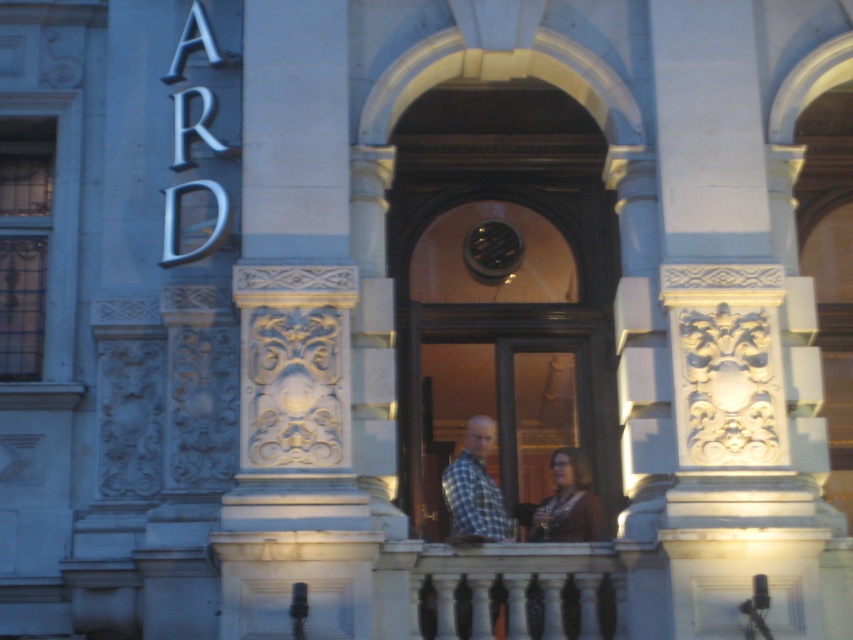
Can you confirm if white stone carving at center is positioned to the left of brown fabric at center?

Correct, you'll find white stone carving at center to the left of brown fabric at center.

Is white stone carving at center smaller than brown fabric at center?

No.

What do you see at coordinates (294, 339) in the screenshot?
I see `white stone carving at center` at bounding box center [294, 339].

Locate an element on the screen. white stone carving at center is located at coordinates (294, 339).

Does white stone carving at center appear on the left side of matte brown sweater at center?

Yes, white stone carving at center is to the left of matte brown sweater at center.

Where is `white stone carving at center`? white stone carving at center is located at coordinates (294, 339).

Does plaid fabric shirt at center appear on the right side of matte brown sweater at center?

No, plaid fabric shirt at center is not to the right of matte brown sweater at center.

Is point (483, 522) farther from camera compared to point (532, 531)?

That is False.

This screenshot has width=853, height=640. What do you see at coordinates (474, 486) in the screenshot?
I see `plaid fabric shirt at center` at bounding box center [474, 486].

What are the coordinates of `plaid fabric shirt at center` in the screenshot? It's located at (474, 486).